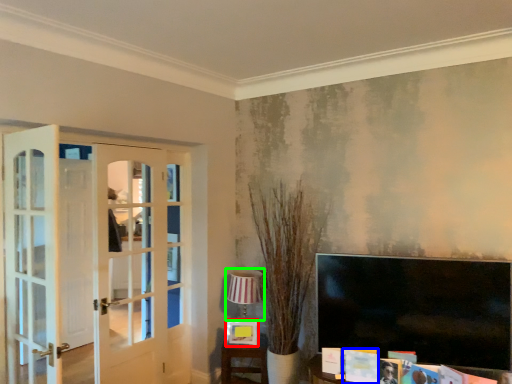
Question: Considering the real-world distances, which object is farthest from picture frame (highlighted by a red box)? magazine (highlighted by a blue box) or lamp (highlighted by a green box)?

Choices:
 (A) magazine
 (B) lamp

Answer: (A)